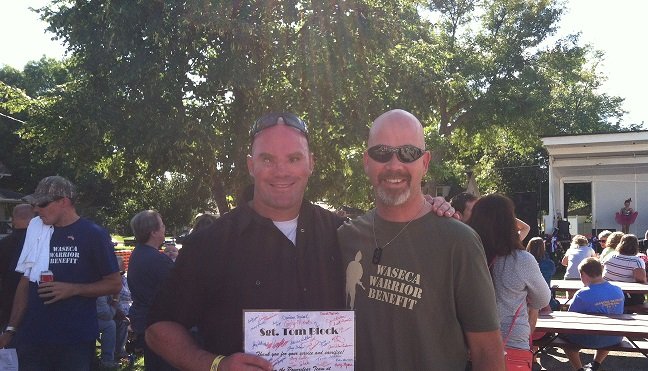
The width and height of the screenshot is (648, 371). I want to click on a4 size white certificate covered in signatures, so (x=305, y=344).